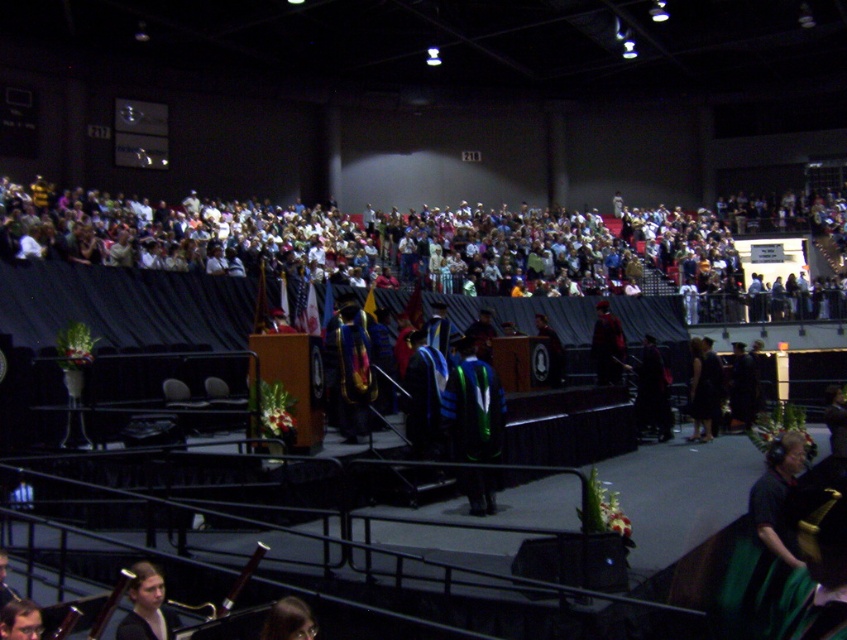
Question: Is multicolored fabric crowd at upper center in front of smooth brown hair at lower left?

Choices:
 (A) yes
 (B) no

Answer: (B)

Question: Among these objects, which one is farthest from the camera?

Choices:
 (A) multicolored fabric crowd at upper center
 (B) smooth brown hair at lower left

Answer: (A)

Question: Can you confirm if multicolored fabric crowd at upper center is smaller than smooth brown hair at lower left?

Choices:
 (A) yes
 (B) no

Answer: (B)

Question: Which point is farther to the camera?

Choices:
 (A) multicolored fabric crowd at upper center
 (B) smooth brown hair at lower left

Answer: (A)

Question: Where is multicolored fabric crowd at upper center located in relation to smooth brown hair at lower left in the image?

Choices:
 (A) right
 (B) left

Answer: (A)